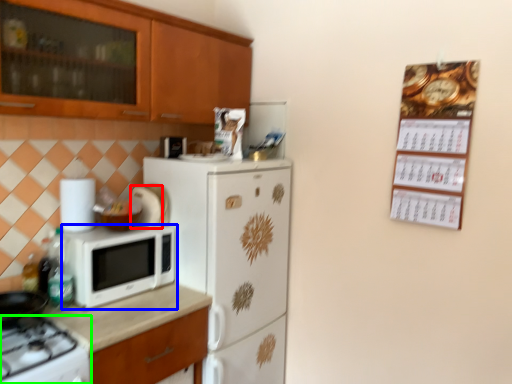
Question: Based on their relative distances, which object is farther from appliance (highlighted by a red box)? Choose from microwave oven (highlighted by a blue box) and gas stove (highlighted by a green box).

Choices:
 (A) microwave oven
 (B) gas stove

Answer: (B)